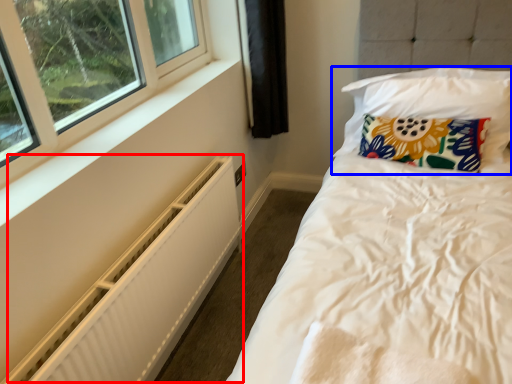
Question: Which point is closer to the camera, radiator (highlighted by a red box) or pillow (highlighted by a blue box)?

Choices:
 (A) radiator
 (B) pillow

Answer: (A)